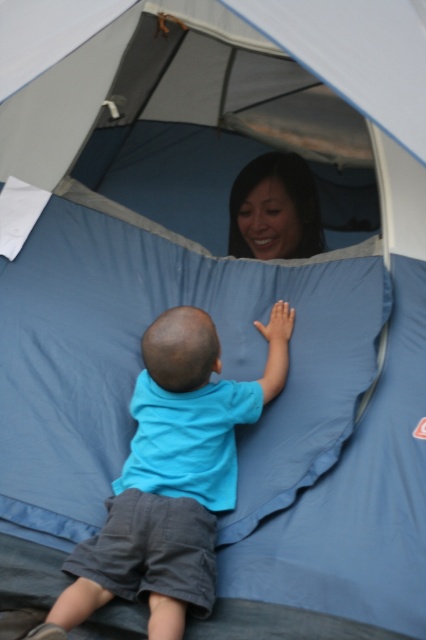
You are a photographer inside the tent and want to take a picture of the blue cotton shirt at center. Where should you aim your camera to capture it?

The blue cotton shirt at center is located at the 2D coordinates point (158, 419), so aim your camera there to capture it.

You are a photographer trying to capture the child in the image. The child is facing away from the camera, but you want to adjust your position to see the smooth skin face at upper center. Which direction should you move relative to the blue cotton shirt at center?

Since the blue cotton shirt at center is on the left side of the smooth skin face at upper center, you should move to the right side of the blue cotton shirt at center to face towards the smooth skin face at upper center.